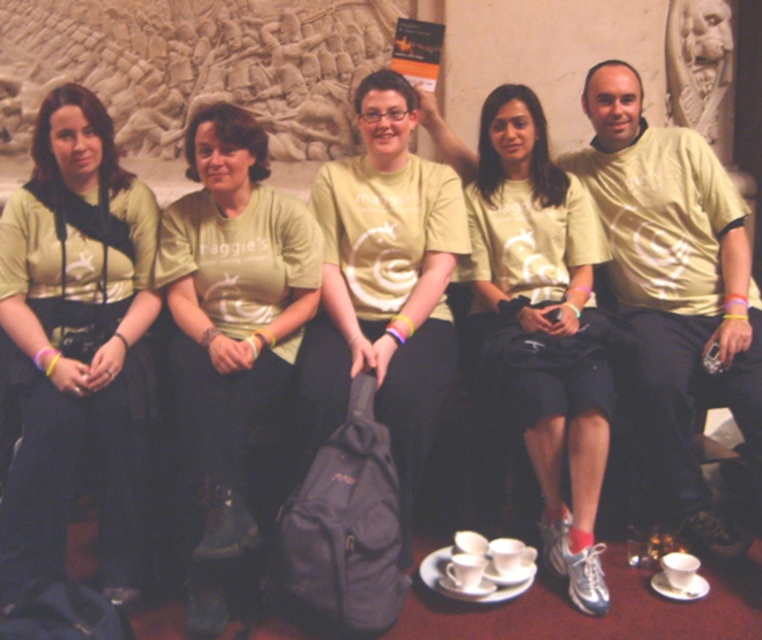
Image resolution: width=762 pixels, height=640 pixels. Describe the element at coordinates (677, 588) in the screenshot. I see `white ceramic saucer at lower right` at that location.

In the scene shown: Does white ceramic saucer at lower right appear over white ceramic saucer at lower center?

Yes, white ceramic saucer at lower right is above white ceramic saucer at lower center.

Is point (655, 586) closer to viewer compared to point (472, 595)?

That is False.

Identify the location of white ceramic saucer at lower right. The image size is (762, 640). (677, 588).

Which is in front, point (760, 426) or point (479, 580)?

Point (479, 580) is more forward.

Between light yellow cotton t-shirt at right and white ceramic saucer at lower center, which one is positioned higher?

light yellow cotton t-shirt at right

Looking at this image, who is more forward, (719, 384) or (436, 579)?

Point (436, 579) is more forward.

Where is `light yellow cotton t-shirt at right`? This screenshot has height=640, width=762. light yellow cotton t-shirt at right is located at coordinates (674, 289).

Which is in front, point (120, 340) or point (191, 164)?

Point (120, 340) is in front.

Is point (74, 189) closer to camera compared to point (194, 330)?

No, it is behind (194, 330).

Is point (106, 412) farther from camera compared to point (287, 289)?

No, it is not.

Identify the location of matte yellow shirt at left. (75, 344).